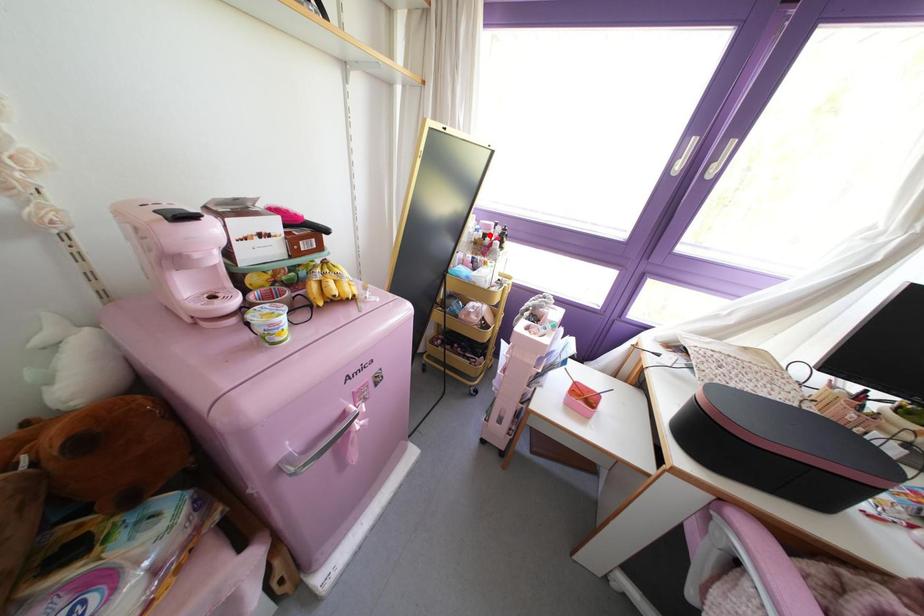
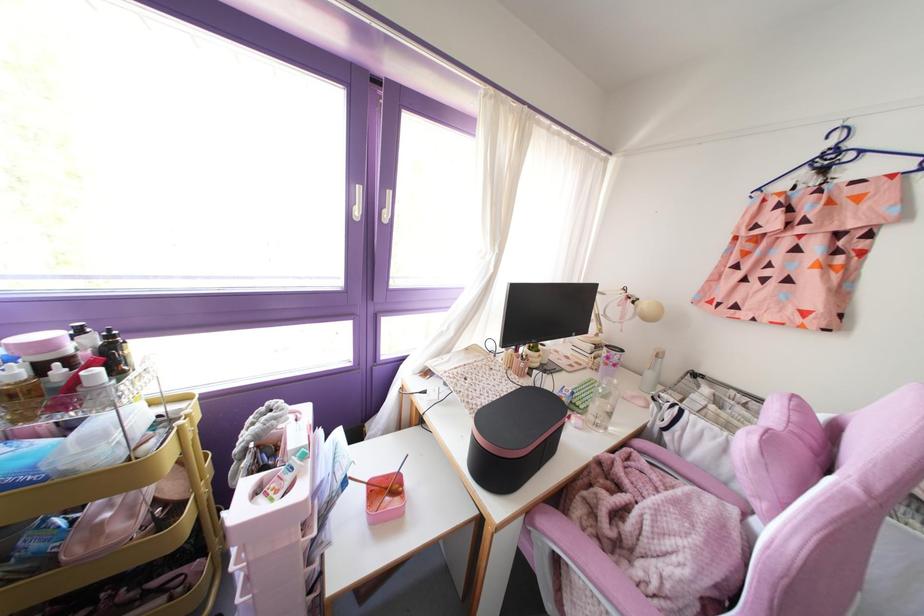
Question: A red point is marked in image1. In image2, is the corresponding 3D point closer to the camera or farther? Reply with the corresponding letter.

Choices:
 (A) The corresponding 3D point is closer.
 (B) The corresponding 3D point is farther.

Answer: (B)